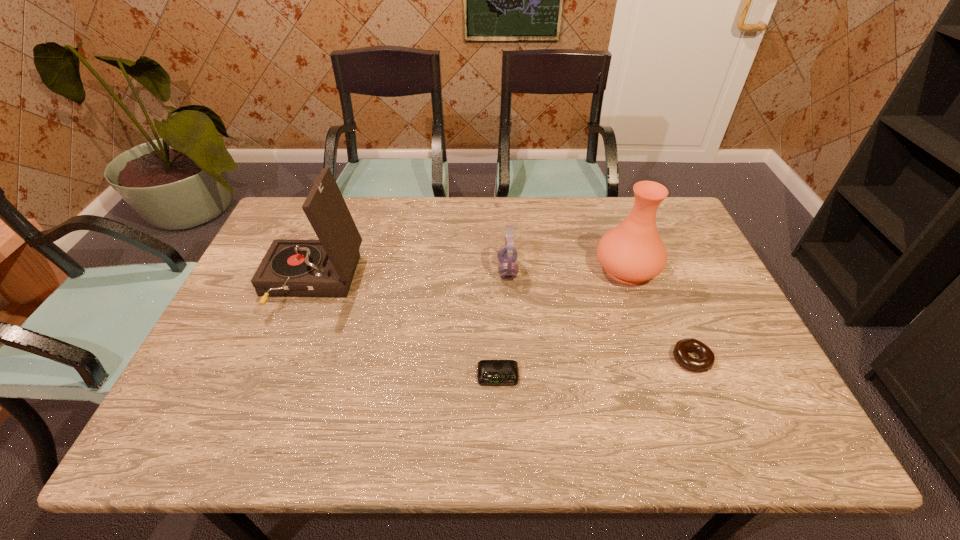
I want to click on phonograph record, so click(x=291, y=268).

Locate an element on the screen. The width and height of the screenshot is (960, 540). vase is located at coordinates (632, 252).

Locate an element on the screen. The image size is (960, 540). headset is located at coordinates (507, 255).

The width and height of the screenshot is (960, 540). Identify the location of doughnut. (707, 358).

This screenshot has width=960, height=540. What are the coordinates of `the shortest object` in the screenshot? It's located at (490, 372).

The image size is (960, 540). In order to click on free region located 0.260m on the back of the leftmost object in this screenshot , I will do `click(342, 205)`.

At what (x,y) coordinates should I click in order to perform the action: click on free space located on the front of the vase. Please return your answer as a coordinate pair (x, y). Image resolution: width=960 pixels, height=540 pixels. Looking at the image, I should click on (668, 387).

The image size is (960, 540). Find the location of `free region located on the headband and ear cups of the headset`. free region located on the headband and ear cups of the headset is located at coordinates (476, 270).

Locate an element on the screen. The image size is (960, 540). free space located 0.230m on the headband and ear cups of the headset is located at coordinates (418, 270).

At what (x,y) coordinates should I click in order to perform the action: click on vacant point located 0.380m on the headband and ear cups of the headset. Please return your answer as a coordinate pair (x, y). This screenshot has height=540, width=960. Looking at the image, I should click on (366, 270).